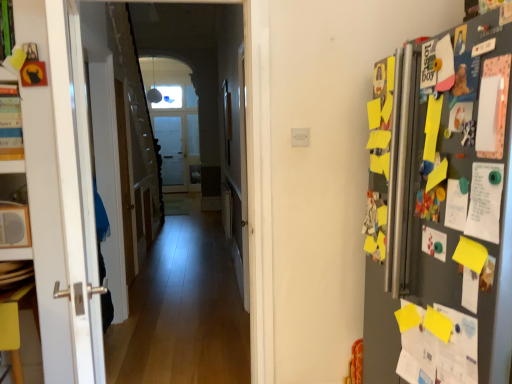
Question: Does matte white lampshade at upper center appear on the left side of wooden floor at center?

Choices:
 (A) no
 (B) yes

Answer: (B)

Question: From the image's perspective, is matte white lampshade at upper center below wooden floor at center?

Choices:
 (A) yes
 (B) no

Answer: (B)

Question: Is matte white lampshade at upper center looking in the opposite direction of wooden floor at center?

Choices:
 (A) yes
 (B) no

Answer: (B)

Question: Does matte white lampshade at upper center have a lesser width compared to wooden floor at center?

Choices:
 (A) yes
 (B) no

Answer: (B)

Question: Does matte white lampshade at upper center have a smaller size compared to wooden floor at center?

Choices:
 (A) yes
 (B) no

Answer: (A)

Question: Is the surface of matte white lampshade at upper center in direct contact with wooden floor at center?

Choices:
 (A) no
 (B) yes

Answer: (A)

Question: Does yellow paper at lower right have a lesser width compared to wooden floor at center?

Choices:
 (A) no
 (B) yes

Answer: (A)

Question: Is yellow paper at lower right behind wooden floor at center?

Choices:
 (A) yes
 (B) no

Answer: (B)

Question: Would you say yellow paper at lower right is a long distance from wooden floor at center?

Choices:
 (A) yes
 (B) no

Answer: (A)

Question: Is yellow paper at lower right at the right side of wooden floor at center?

Choices:
 (A) no
 (B) yes

Answer: (B)

Question: Considering the relative sizes of yellow paper at lower right and wooden floor at center in the image provided, is yellow paper at lower right taller than wooden floor at center?

Choices:
 (A) yes
 (B) no

Answer: (B)

Question: Considering the relative sizes of yellow paper at lower right and wooden floor at center in the image provided, is yellow paper at lower right wider than wooden floor at center?

Choices:
 (A) yes
 (B) no

Answer: (A)

Question: Does yellow paper at lower right turn towards white matte speaker at left?

Choices:
 (A) yes
 (B) no

Answer: (B)